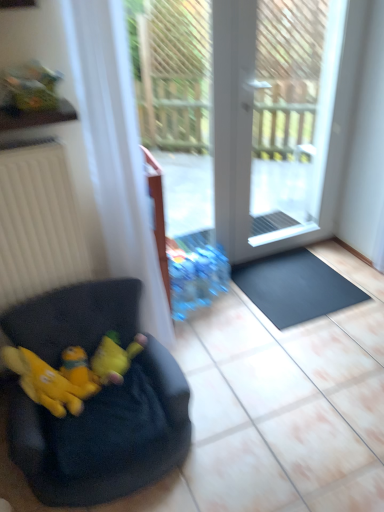
Locate an element on the screen. The image size is (384, 512). yellow plush toy at lower left, which appears as the second animal when viewed from the right is located at coordinates (x=54, y=379).

What do you see at coordinates (288, 119) in the screenshot?
I see `white glass screen door at center` at bounding box center [288, 119].

The image size is (384, 512). Describe the element at coordinates (295, 287) in the screenshot. I see `black rubber doormat at lower right` at that location.

The height and width of the screenshot is (512, 384). In order to click on yellow plush toy at lower left, the second animal positioned from the left in this screenshot , I will do [x=114, y=358].

Describe the element at coordinates (115, 150) in the screenshot. I see `white sheer curtain at left` at that location.

Locate an element on the screen. The width and height of the screenshot is (384, 512). black fabric bean bag at lower left is located at coordinates (104, 436).

Which of these two, white sheer curtain at left or yellow plush toy at lower left, the second animal positioned from the left, is thinner?

Thinner between the two is yellow plush toy at lower left, the second animal positioned from the left.

Do you think white sheer curtain at left is within yellow plush toy at lower left, marked as the 1th animal in a right-to-left arrangement, or outside of it?

white sheer curtain at left exists outside the volume of yellow plush toy at lower left, marked as the 1th animal in a right-to-left arrangement.

Where is `curtain that appears on the left of yellow plush toy at lower left, the second animal positioned from the left`? curtain that appears on the left of yellow plush toy at lower left, the second animal positioned from the left is located at coordinates (115, 150).

From a real-world perspective, which object stands above the other?

In real-world perspective, white sheer curtain at left is above.

Measure the distance between black rubber doormat at lower right and yellow plush toy at lower left, marked as the 1th animal in a right-to-left arrangement.

black rubber doormat at lower right is 1.02 meters from yellow plush toy at lower left, marked as the 1th animal in a right-to-left arrangement.

Between black rubber doormat at lower right and yellow plush toy at lower left, marked as the 1th animal in a right-to-left arrangement, which one appears on the left side from the viewer's perspective?

yellow plush toy at lower left, marked as the 1th animal in a right-to-left arrangement.

From a real-world perspective, is black rubber doormat at lower right physically below yellow plush toy at lower left, the second animal positioned from the left?

Yes.

Considering the positions of point (117, 213) and point (56, 383), is point (117, 213) closer or farther from the camera than point (56, 383)?

Clearly, point (117, 213) is more distant from the camera than point (56, 383).

From the image's perspective, does white sheer curtain at left appear higher than yellow plush toy at lower left, which appears as the second animal when viewed from the right?

Indeed, from the image's perspective, white sheer curtain at left is shown above yellow plush toy at lower left, which appears as the second animal when viewed from the right.

Consider the image. Who is bigger, white sheer curtain at left or yellow plush toy at lower left, the first animal when ordered from left to right?

Bigger between the two is white sheer curtain at left.

Considering the relative sizes of white sheer curtain at left and yellow plush toy at lower left, which appears as the second animal when viewed from the right, in the image provided, is white sheer curtain at left taller than yellow plush toy at lower left, which appears as the second animal when viewed from the right,?

Yes.

In the scene shown: Considering their positions, is yellow plush at left located in front of or behind black rubber doormat at lower right?

Visually, yellow plush at left is located in front of black rubber doormat at lower right.

Identify the location of toy above the black rubber doormat at lower right (from a real-world perspective). (79, 371).

How many degrees apart are the facing directions of yellow plush at left and black rubber doormat at lower right?

There is a 2.71-degree angle between the facing directions of yellow plush at left and black rubber doormat at lower right.

Find the location of a particular element. This screenshot has width=384, height=512. the 2nd animal behind the black fabric bean bag at lower left is located at coordinates (114, 358).

Is yellow plush toy at lower left, marked as the 1th animal in a right-to-left arrangement, far from black fabric bean bag at lower left?

No, yellow plush toy at lower left, marked as the 1th animal in a right-to-left arrangement, is in close proximity to black fabric bean bag at lower left.

Is black fabric bean bag at lower left at the back of yellow plush toy at lower left, the second animal positioned from the left?

Yes.

Which is behind, yellow plush toy at lower left, marked as the 1th animal in a right-to-left arrangement, or black fabric bean bag at lower left?

yellow plush toy at lower left, marked as the 1th animal in a right-to-left arrangement, is behind.

Is black rubber doormat at lower right looking in the opposite direction of yellow plush at left?

black rubber doormat at lower right does not have its back to yellow plush at left.

What are the coordinates of `doormat behind the yellow plush at left` in the screenshot? It's located at (295, 287).

Which is behind, black rubber doormat at lower right or yellow plush at left?

black rubber doormat at lower right is further away from the camera.

Does point (255, 295) come farther from viewer compared to point (83, 377)?

Yes.

From a real-world perspective, is white sheer curtain at left beneath yellow plush at left?

No.

The image size is (384, 512). Find the location of `curtain above the yellow plush at left (from a real-world perspective)`. curtain above the yellow plush at left (from a real-world perspective) is located at coordinates (115, 150).

Is white sheer curtain at left bigger or smaller than yellow plush at left?

Clearly, white sheer curtain at left is larger in size than yellow plush at left.

Which object is further away from the camera, white sheer curtain at left or yellow plush at left?

yellow plush at left is more distant.

The height and width of the screenshot is (512, 384). I want to click on the 2nd animal behind the white sheer curtain at left, so click(114, 358).

At what (x,y) coordinates should I click in order to perform the action: click on animal that is the 1st one when counting leftward from the black rubber doormat at lower right. Please return your answer as a coordinate pair (x, y). Looking at the image, I should click on (114, 358).

From the image, which object appears to be nearer to white glass screen door at center, yellow plush at left or black rubber doormat at lower right?

Among the two, black rubber doormat at lower right is located nearer to white glass screen door at center.

Based on the photo, based on their spatial positions, is yellow plush at left or yellow plush toy at lower left, the second animal positioned from the left, closer to white glass screen door at center?

yellow plush toy at lower left, the second animal positioned from the left, is closer to white glass screen door at center.

Estimate the real-world distances between objects in this image. Which object is further from yellow plush toy at lower left, marked as the 1th animal in a right-to-left arrangement, yellow plush toy at lower left, which appears as the second animal when viewed from the right, or white sheer curtain at left?

white sheer curtain at left lies further to yellow plush toy at lower left, marked as the 1th animal in a right-to-left arrangement, than the other object.

Which object lies further to the anchor point white glass screen door at center, yellow plush toy at lower left, which appears as the second animal when viewed from the right, or yellow plush toy at lower left, the second animal positioned from the left?

Among the two, yellow plush toy at lower left, the second animal positioned from the left, is located further to white glass screen door at center.

Considering their positions, is white sheer curtain at left positioned further to white glass screen door at center than yellow plush toy at lower left, marked as the 1th animal in a right-to-left arrangement?

Among the two, yellow plush toy at lower left, marked as the 1th animal in a right-to-left arrangement, is located further to white glass screen door at center.

Which object lies nearer to the anchor point white glass screen door at center, yellow plush toy at lower left, the second animal positioned from the left, or yellow plush toy at lower left, the first animal when ordered from left to right?

yellow plush toy at lower left, the first animal when ordered from left to right, is positioned closer to the anchor white glass screen door at center.

Based on the photo, when comparing their distances from yellow plush toy at lower left, which appears as the second animal when viewed from the right, does black fabric bean bag at lower left or yellow plush toy at lower left, the second animal positioned from the left, seem further?

black fabric bean bag at lower left is further to yellow plush toy at lower left, which appears as the second animal when viewed from the right.

Looking at the image, which one is located further to black rubber doormat at lower right, white sheer curtain at left or black fabric bean bag at lower left?

Among the two, black fabric bean bag at lower left is located further to black rubber doormat at lower right.

This screenshot has width=384, height=512. What are the coordinates of `screen door located between yellow plush at left and black rubber doormat at lower right in the left-right direction` in the screenshot? It's located at (288, 119).

Where is `toy between white sheer curtain at left and black fabric bean bag at lower left in the vertical direction`? This screenshot has height=512, width=384. toy between white sheer curtain at left and black fabric bean bag at lower left in the vertical direction is located at coordinates (79, 371).

The width and height of the screenshot is (384, 512). In order to click on toy between yellow plush toy at lower left, the first animal when ordered from left to right, and black rubber doormat at lower right in this screenshot , I will do `click(79, 371)`.

Locate an element on the screen. animal positioned between black fabric bean bag at lower left and yellow plush toy at lower left, marked as the 1th animal in a right-to-left arrangement, from near to far is located at coordinates (54, 379).